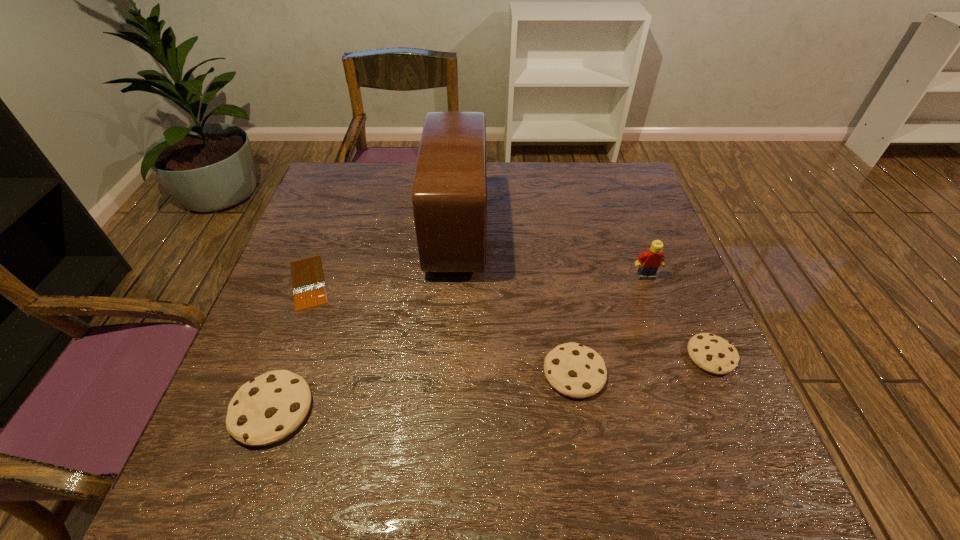
You are a GUI agent. You are given a task and a screenshot of the screen. Output one action in this format:
    pyautogui.click(x=<x>, y=<y>)
    Task: Click on the vacant region located on the right of the tallest cookie
    
    Given the screenshot: What is the action you would take?
    pyautogui.click(x=396, y=410)

I want to click on vacant space located 0.100m on the back of the second shortest cookie, so click(564, 310).

At what (x,y) coordinates should I click in order to perform the action: click on free space located on the back of the shortest cookie. Please return your answer as a coordinate pair (x, y). Looking at the image, I should click on (664, 246).

I want to click on vacant space located on the front-facing side of the radio receiver, so pyautogui.click(x=555, y=230).

Identify the location of blank space located on the front-facing side of the Lego. This screenshot has width=960, height=540. (692, 405).

Locate an element on the screen. The image size is (960, 540). vacant space located 0.210m on the right of the shortest object is located at coordinates (421, 282).

I want to click on object at the far edge, so click(449, 197).

Identify the location of cookie located in the left edge section of the desktop. (268, 408).

Locate an element on the screen. chocolate bar positioned at the left edge is located at coordinates (308, 283).

You are a GUI agent. You are given a task and a screenshot of the screen. Output one action in this format:
    pyautogui.click(x=<x>, y=<y>)
    Task: Click on the cookie that is at the right edge
    The image size is (960, 540).
    Given the screenshot: What is the action you would take?
    pyautogui.click(x=713, y=354)